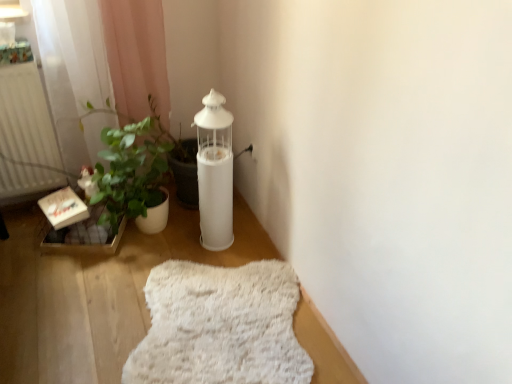
You are a GUI agent. You are given a task and a screenshot of the screen. Output one action in this format:
    pyautogui.click(x=<x>, y=<y>)
    Task: Click on the empty space that is ontop of wooden crate at lower left (from a real-world perspective)
    The image size is (512, 384).
    Given the screenshot: What is the action you would take?
    pyautogui.click(x=84, y=235)